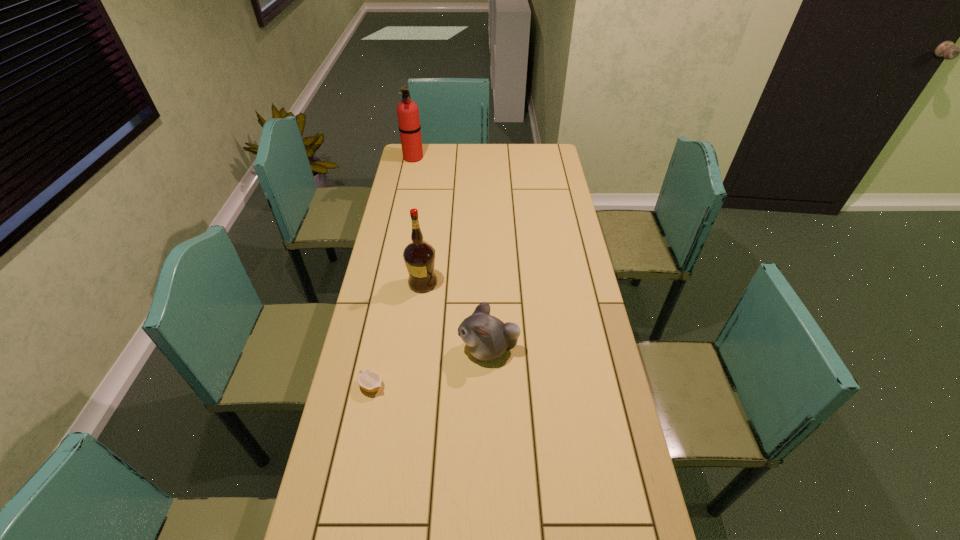
At what (x,y) coordinates should I click in order to perform the action: click on the farthest object. Please return your answer as a coordinate pair (x, y). Looking at the image, I should click on (408, 113).

Locate an element on the screen. The height and width of the screenshot is (540, 960). the third object from left to right is located at coordinates (419, 256).

Identify the location of alcohol. The image size is (960, 540). (419, 256).

Identify the location of the rightmost object. This screenshot has width=960, height=540. pos(486,337).

Locate an element on the screen. The width and height of the screenshot is (960, 540). the second nearest object is located at coordinates (486, 337).

Where is `the nearest object`? the nearest object is located at coordinates (369, 380).

This screenshot has width=960, height=540. What are the coordinates of `the shortest object` in the screenshot? It's located at (369, 380).

Locate an element on the screen. The width and height of the screenshot is (960, 540). free space located at the nozzle of the farthest object is located at coordinates (454, 157).

This screenshot has height=540, width=960. Identify the location of free space located 0.060m on the label of the third object from left to right. (455, 283).

This screenshot has width=960, height=540. Identify the location of free region located 0.090m on the face of the hamster. (429, 349).